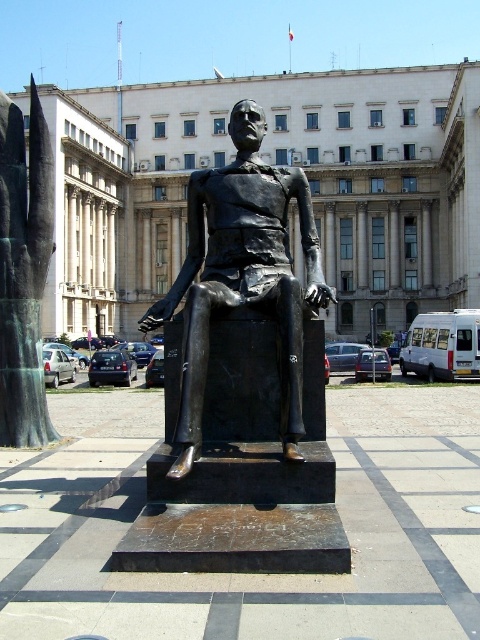
Question: Which point is closer to the camera?

Choices:
 (A) bronze statue at left
 (B) white marble building at center
 (C) bronze statue at center

Answer: (C)

Question: Is bronze statue at center closer to the viewer compared to bronze statue at left?

Choices:
 (A) no
 (B) yes

Answer: (B)

Question: Does white marble building at center have a larger size compared to bronze statue at left?

Choices:
 (A) yes
 (B) no

Answer: (A)

Question: Can you confirm if white marble building at center is positioned to the right of bronze statue at center?

Choices:
 (A) yes
 (B) no

Answer: (B)

Question: Estimate the real-world distances between objects in this image. Which object is closer to the bronze statue at center?

Choices:
 (A) bronze statue at left
 (B) white marble building at center

Answer: (A)

Question: Which point is closer to the camera?

Choices:
 (A) bronze statue at left
 (B) white marble building at center
 (C) bronze statue at center

Answer: (C)